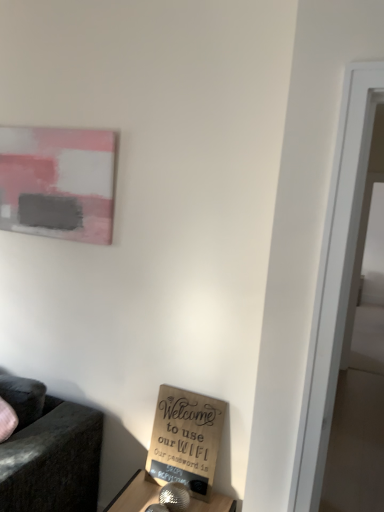
Question: Considering the relative sizes of burlap sign at lower center and matte pink painting at upper left in the image provided, is burlap sign at lower center wider than matte pink painting at upper left?

Choices:
 (A) yes
 (B) no

Answer: (A)

Question: From the image's perspective, is burlap sign at lower center located beneath matte pink painting at upper left?

Choices:
 (A) no
 (B) yes

Answer: (B)

Question: Is burlap sign at lower center looking in the opposite direction of matte pink painting at upper left?

Choices:
 (A) yes
 (B) no

Answer: (B)

Question: Is burlap sign at lower center positioned beyond the bounds of matte pink painting at upper left?

Choices:
 (A) no
 (B) yes

Answer: (B)

Question: Considering the relative positions of burlap sign at lower center and matte pink painting at upper left in the image provided, is burlap sign at lower center in front of matte pink painting at upper left?

Choices:
 (A) yes
 (B) no

Answer: (A)

Question: Considering the relative sizes of burlap sign at lower center and matte pink painting at upper left in the image provided, is burlap sign at lower center bigger than matte pink painting at upper left?

Choices:
 (A) yes
 (B) no

Answer: (B)

Question: Considering the relative sizes of matte pink painting at upper left and burlap sign at lower center in the image provided, is matte pink painting at upper left thinner than burlap sign at lower center?

Choices:
 (A) no
 (B) yes

Answer: (B)

Question: Does matte pink painting at upper left have a lesser height compared to burlap sign at lower center?

Choices:
 (A) no
 (B) yes

Answer: (A)

Question: Is matte pink painting at upper left taller than burlap sign at lower center?

Choices:
 (A) yes
 (B) no

Answer: (A)

Question: From a real-world perspective, is matte pink painting at upper left positioned over burlap sign at lower center based on gravity?

Choices:
 (A) yes
 (B) no

Answer: (A)

Question: Is matte pink painting at upper left aimed at burlap sign at lower center?

Choices:
 (A) no
 (B) yes

Answer: (A)

Question: From the image's perspective, is matte pink painting at upper left located beneath burlap sign at lower center?

Choices:
 (A) yes
 (B) no

Answer: (B)

Question: Is burlap sign at lower center wider or thinner than matte pink painting at upper left?

Choices:
 (A) thin
 (B) wide

Answer: (B)